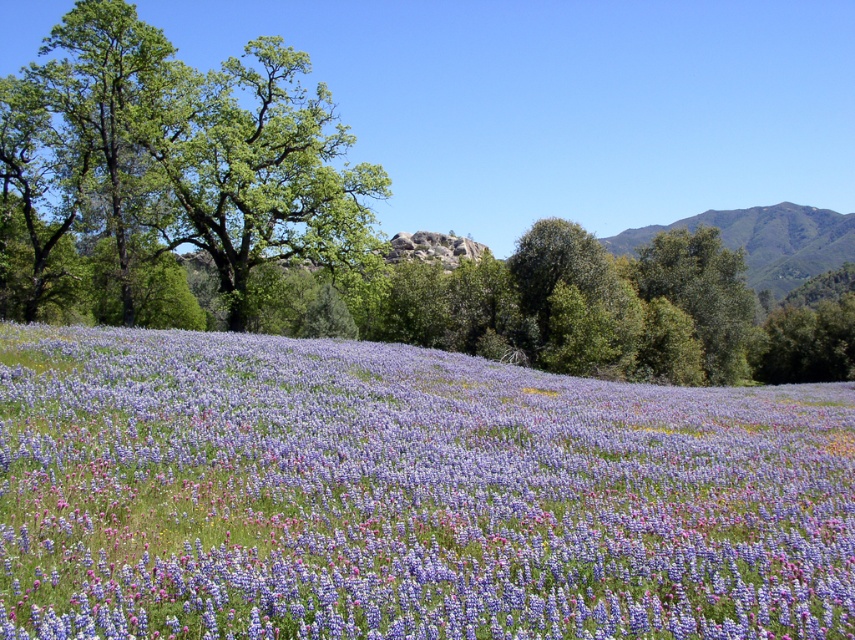
You are an artist sketching this landscape. You want to ensure the purple matte flower at center and the green leafy tree at upper left are proportionally accurate. Which object should you draw wider in your sketch?

The purple matte flower at center should be drawn wider because its width is larger than the green leafy tree at upper left.